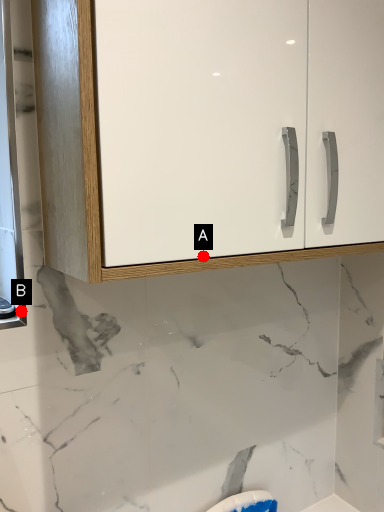
Question: Two points are circled on the image, labeled by A and B beside each circle. Which point is farther to the camera?

Choices:
 (A) A is further
 (B) B is further

Answer: (B)